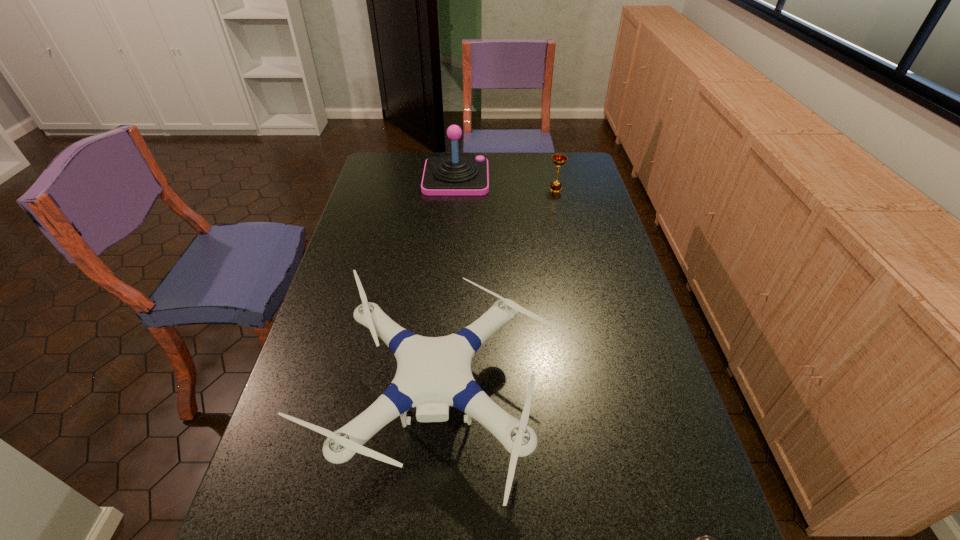
Locate which object ranks third in proximity to the chalice. Please provide its 2D coordinates. Your answer should be formatted as a tuple, i.e. [(x, y)], where the tuple contains the x and y coordinates of a point satisfying the conditions above.

[(701, 539)]

Identify the location of object that is the second closest one to the second tallest object. The height and width of the screenshot is (540, 960). (454, 175).

I want to click on free space that satisfies the following two spatial constraints: 1. forward from the base of the tallest object; 2. on the right side of the third object from left to right, so pos(455,189).

The image size is (960, 540). In order to click on free spot that satisfies the following two spatial constraints: 1. forward from the base of the third object from left to right; 2. on the left side of the tallest object in this screenshot , I will do `click(455, 189)`.